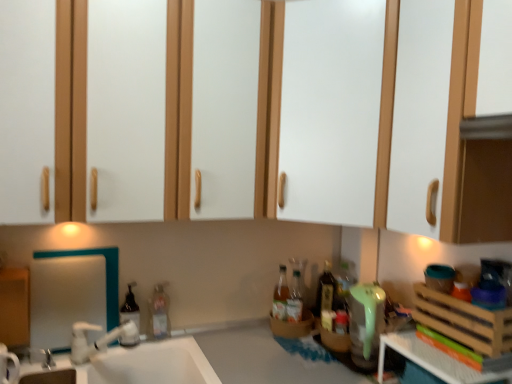
Question: Is point (109, 286) positioned closer to the camera than point (327, 342)?

Choices:
 (A) farther
 (B) closer

Answer: (B)

Question: Based on their positions, is white glossy mirror at left located to the left or right of wooden basket at lower right, the 3th basket viewed from the top?

Choices:
 (A) right
 (B) left

Answer: (B)

Question: Which object is the farthest from the translucent glass bottles at right, positioned as the second bottle in right-to-left order?

Choices:
 (A) white glossy mirror at left
 (B) white matte cabinet at upper center
 (C) translucent plastic bottle at sink, which ranks as the 3th bottle in right-to-left order
 (D) white plastic crate at lower right
 (E) wooden crate at right, which appears as the 3th basket when ordered from the bottom

Answer: (B)

Question: Which object is the closest to the white glossy mirror at left?

Choices:
 (A) translucent plastic soap dispenser at sink, the 4th bottle in the right-to-left sequence
 (B) wooden basket at lower right, which is the 2th basket from front to back
 (C) white matte cabinet at upper center
 (D) wooden crate at right, the 3th basket positioned from the left
 (E) white plastic tap at lower left

Answer: (A)